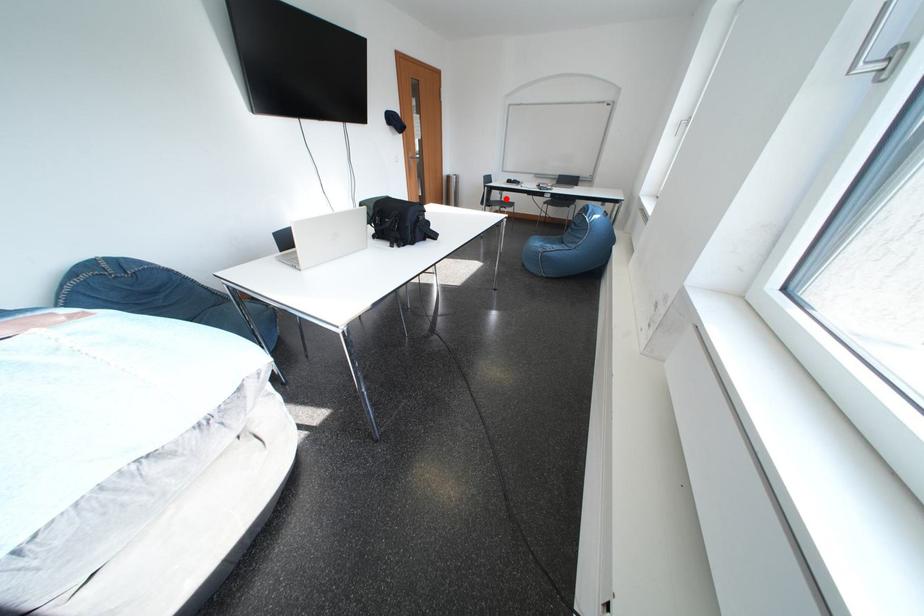
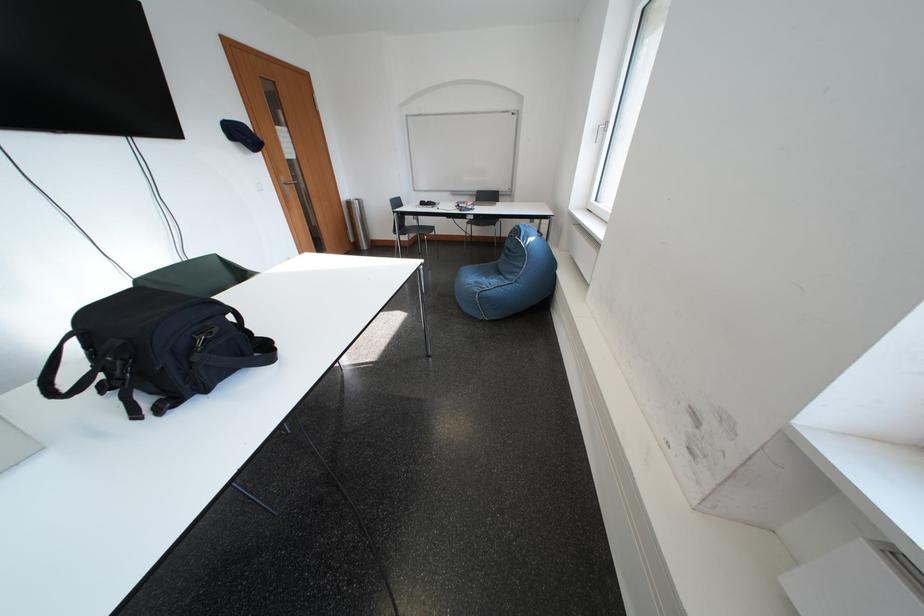
Question: I am providing you with two images of the same scene from different viewpoints. Image1 has a red point marked. In image2, the corresponding 3D location appears at what relative position? Reply with the corresponding letter.

Choices:
 (A) Closer
 (B) Farther

Answer: (A)